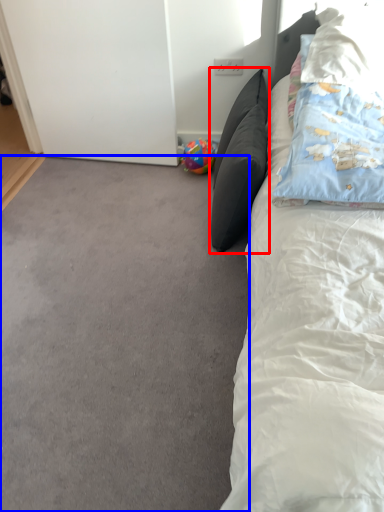
Question: Which object is closer to the camera taking this photo, pillow (highlighted by a red box) or plain (highlighted by a blue box)?

Choices:
 (A) pillow
 (B) plain

Answer: (B)